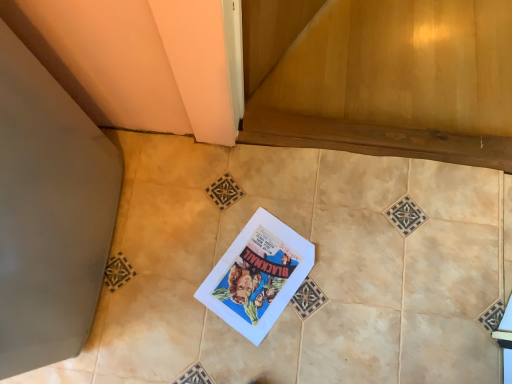
Find the location of a particular element. This screenshot has width=512, height=384. blank space above matte paper comic book at center (from a real-world perspective) is located at coordinates (261, 276).